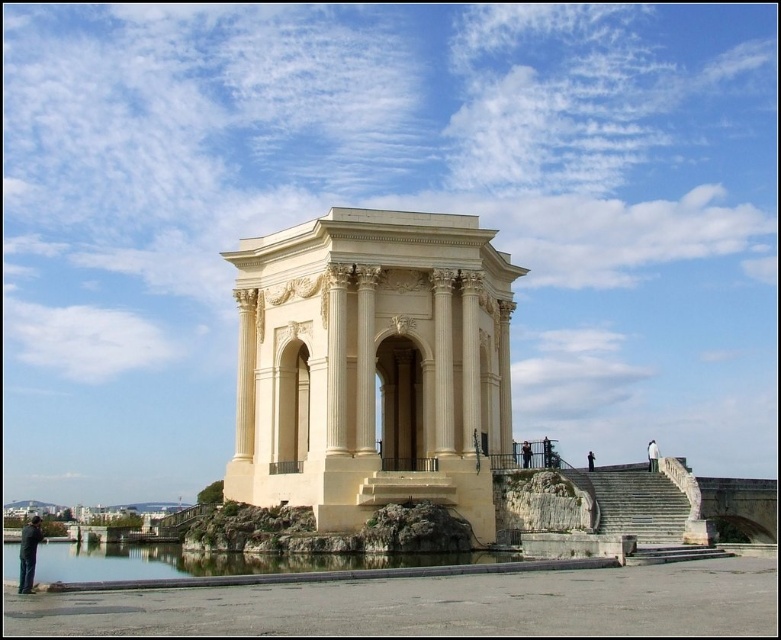
Question: Which object is positioned farthest from the white stone person at right?

Choices:
 (A) clear water at lower center
 (B) black fabric person at upper center
 (C) black leather pants at lower left

Answer: (C)

Question: Estimate the real-world distances between objects in this image. Which object is farther from the black fabric person at upper center?

Choices:
 (A) clear water at lower center
 (B) black fabric person at center

Answer: (A)

Question: Is black leather pants at lower left closer to the viewer compared to black fabric person at upper center?

Choices:
 (A) yes
 (B) no

Answer: (A)

Question: Can you confirm if white stone person at right is positioned below black fabric person at center?

Choices:
 (A) yes
 (B) no

Answer: (A)

Question: Is white marble monument at center closer to the viewer compared to white stone person at right?

Choices:
 (A) no
 (B) yes

Answer: (B)

Question: Among these points, which one is nearest to the camera?

Choices:
 (A) (589, 452)
 (B) (289, 484)
 (C) (362, 563)

Answer: (C)